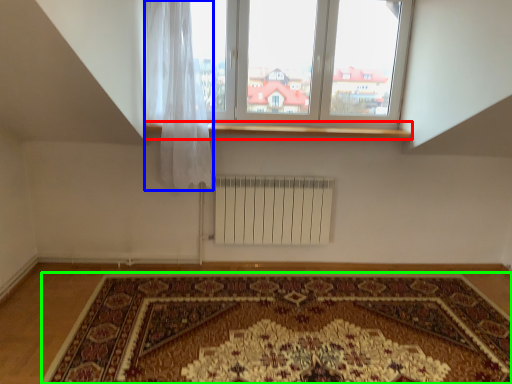
Question: Estimate the real-world distances between objects in this image. Which object is closer to window sill (highlighted by a red box), curtain (highlighted by a blue box) or mat (highlighted by a green box)?

Choices:
 (A) curtain
 (B) mat

Answer: (A)